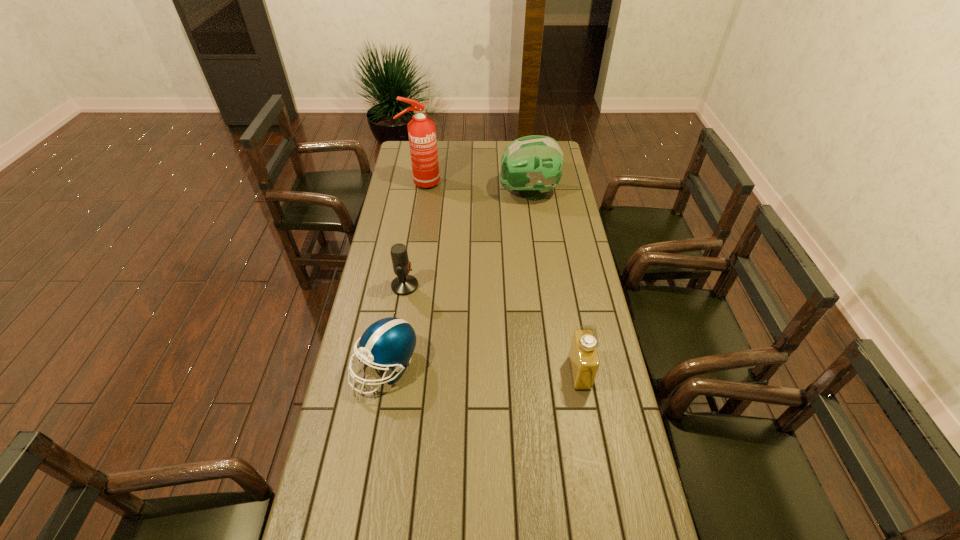
The height and width of the screenshot is (540, 960). I want to click on perfume at the right edge, so click(x=583, y=356).

In the image, there is a desktop. What are the coordinates of `vacant area at the far edge` in the screenshot? It's located at (471, 141).

In the image, there is a desktop. In order to click on vacant region at the left edge in this screenshot , I will do `click(373, 396)`.

The image size is (960, 540). What are the coordinates of `vacant space at the right edge of the desktop` in the screenshot? It's located at (573, 234).

At what (x,y) coordinates should I click in order to perform the action: click on free space between the fourth shortest object and the left football helmet. Please return your answer as a coordinate pair (x, y). The height and width of the screenshot is (540, 960). Looking at the image, I should click on (457, 280).

Identify the location of free area in between the left football helmet and the perfume. The image size is (960, 540). (483, 369).

This screenshot has width=960, height=540. Identify the location of unoccupied position between the third nearest object and the taller football helmet. (467, 239).

What are the coordinates of `vacant area between the second tallest object and the left football helmet` in the screenshot? It's located at (457, 280).

You are a GUI agent. You are given a task and a screenshot of the screen. Output one action in this format:
    pyautogui.click(x=<x>, y=<y>)
    Task: Click on the free space between the perfume and the fire extinguisher
    The width and height of the screenshot is (960, 540).
    Given the screenshot: What is the action you would take?
    pyautogui.click(x=500, y=278)

Find the location of a particular element. The width and height of the screenshot is (960, 540). unoccupied area between the left football helmet and the right football helmet is located at coordinates (457, 280).